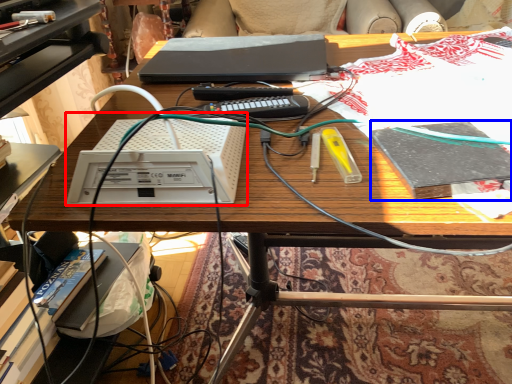
Question: Among these objects, which one is nearest to the camera, equipment (highlighted by a red box) or book (highlighted by a blue box)?

Choices:
 (A) equipment
 (B) book

Answer: (A)